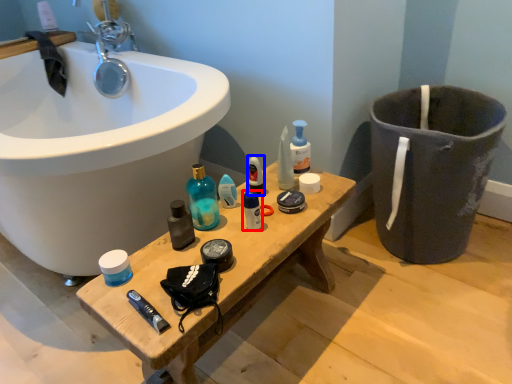
Question: Which object appears closest to the camera in this image, toiletry (highlighted by a red box) or mouthwash (highlighted by a blue box)?

Choices:
 (A) toiletry
 (B) mouthwash

Answer: (A)